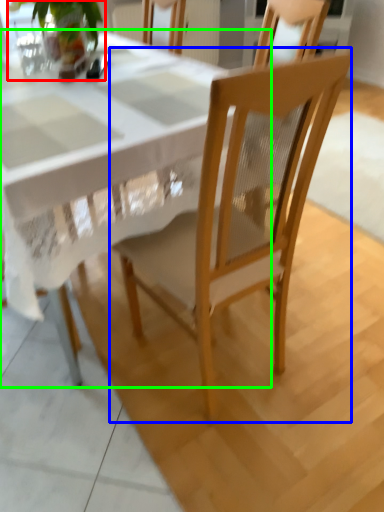
Question: Estimate the real-world distances between objects in this image. Which object is closer to houseplant (highlighted by a red box), chair (highlighted by a blue box) or round table (highlighted by a green box)?

Choices:
 (A) chair
 (B) round table

Answer: (B)